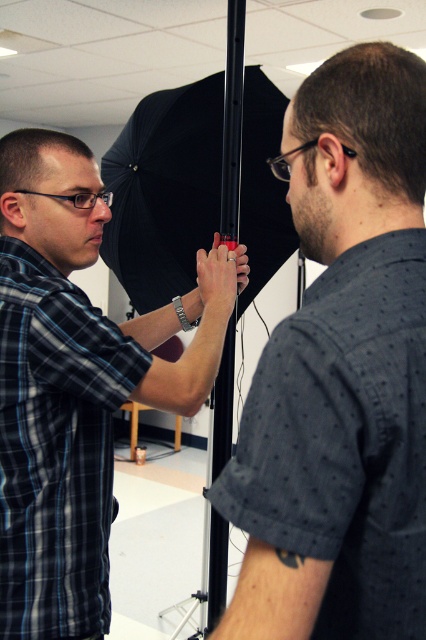
You are a photographer setting up a lighting rig. You need to ensure that the plaid shirt at left and the black matte umbrella at center are positioned so that the umbrella doesn not block the light from reaching the subject. Given their heights, which object should be placed higher to achieve this?

The plaid shirt at left is taller than the black matte umbrella at center. To ensure the umbrella does not block the light, the plaid shirt at left should be placed higher so that its height allows the light to pass over the black matte umbrella at center without obstruction.

You are a photographer setting up equipment in the studio. You have a black matte pole at center and a black matte umbrella at center. Which object would you need to adjust if you want to increase the lighting coverage area without moving the other equipment?

The black matte umbrella at center should be adjusted because it has a larger size than the black matte pole at center, allowing for greater control over the lighting coverage area when expanded or repositioned.

You are standing in the studio and need to position a new light stand exactly 0.1 units to the right of the black matte pole at center. What are the coordinates where you should place the new light stand?

The coordinates for the new light stand should be approximately [342,438], since the black matte pole at center is at [342,374] and moving 0.1 units to the right adds to the x coordinate.